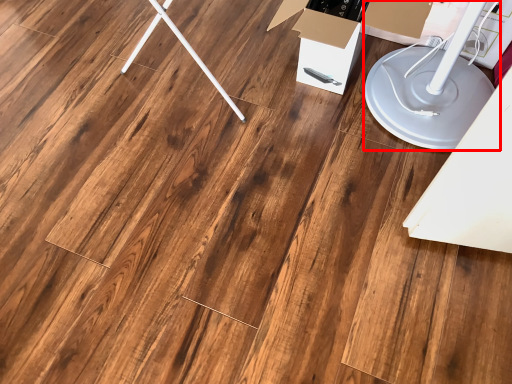
Question: Where is lift (annotated by the red box) located in relation to cardboard box in the image?

Choices:
 (A) right
 (B) left

Answer: (A)